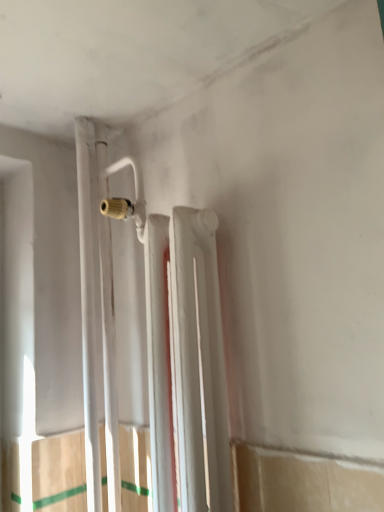
In order to face white matte radiator at center, should I rotate leftwards or rightwards?

You should look right and rotate roughly 1.866 degrees.

Image resolution: width=384 pixels, height=512 pixels. What do you see at coordinates (199, 359) in the screenshot?
I see `white matte radiator at center` at bounding box center [199, 359].

Find the location of a particular element. The height and width of the screenshot is (512, 384). white matte radiator at center is located at coordinates (199, 359).

Locate an element on the screen. The height and width of the screenshot is (512, 384). white matte radiator at center is located at coordinates (199, 359).